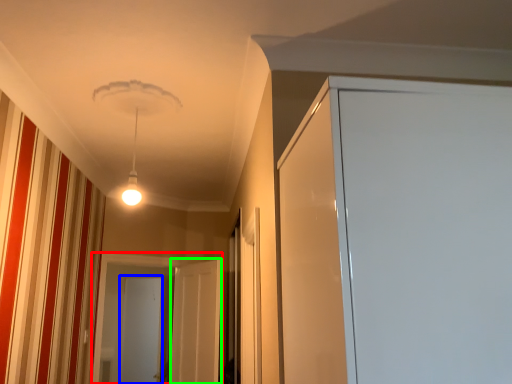
Question: Which object is the farthest from screen door (highlighted by a red box)? Choose among these: screen door (highlighted by a blue box) or screen door (highlighted by a green box).

Choices:
 (A) screen door
 (B) screen door

Answer: (A)